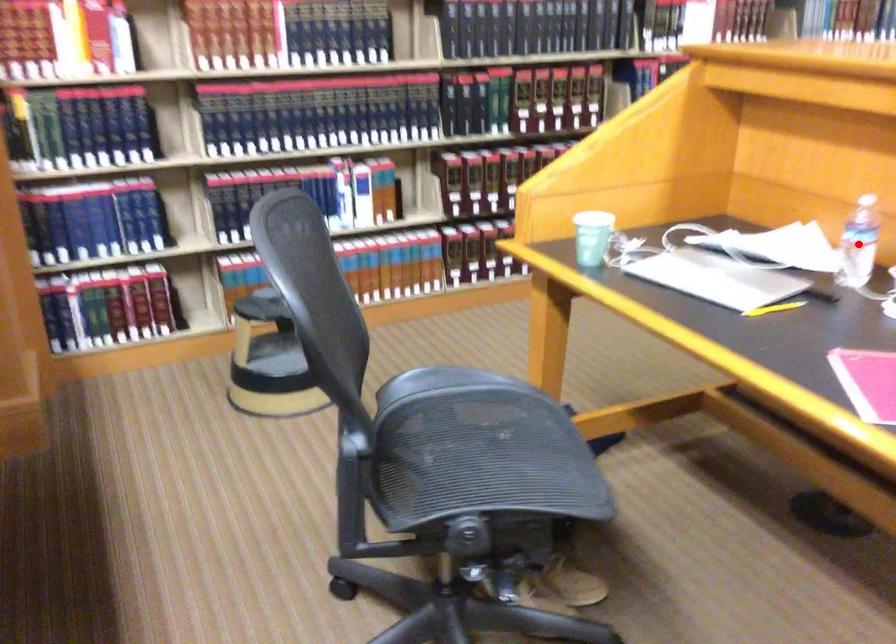
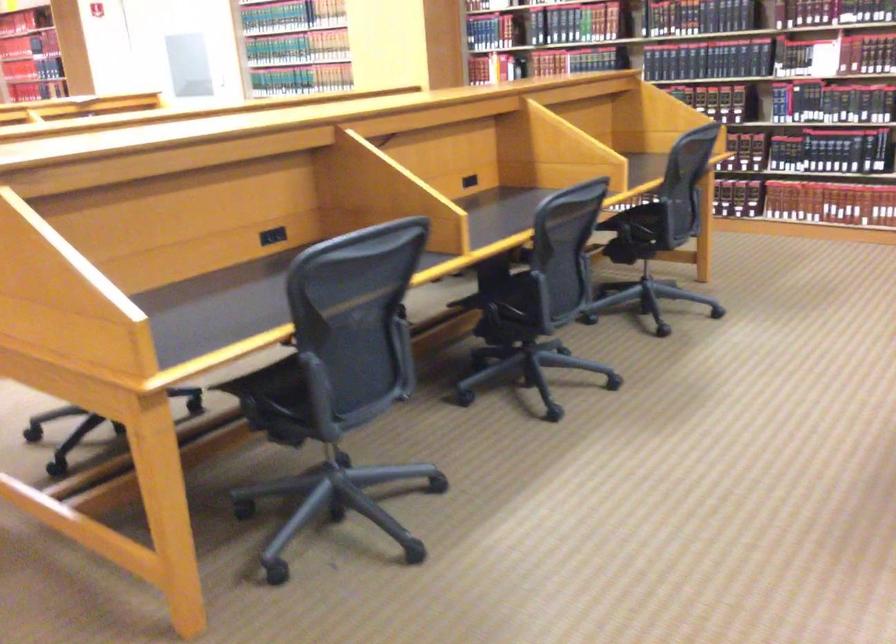
Question: I am providing you with two images of the same scene from different viewpoints. A red point is marked on the first image. Can you still see the location of the red point in image 2?

Choices:
 (A) Yes
 (B) No

Answer: (B)